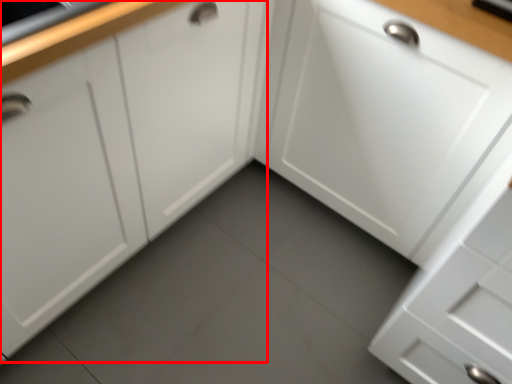
Question: From the image's perspective, what is the correct spatial relationship of cabinetry (annotated by the red box) in relation to cabinetry?

Choices:
 (A) above
 (B) below

Answer: (A)